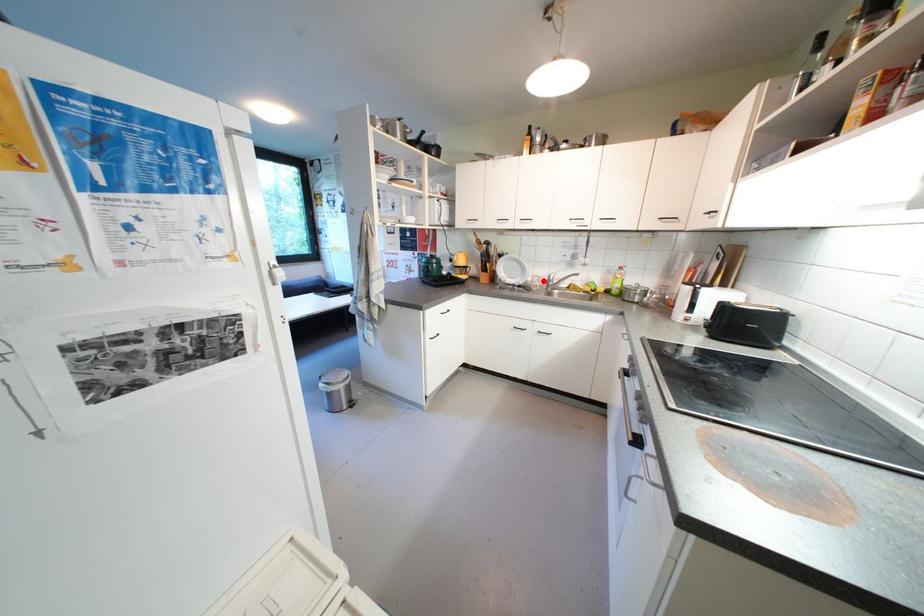
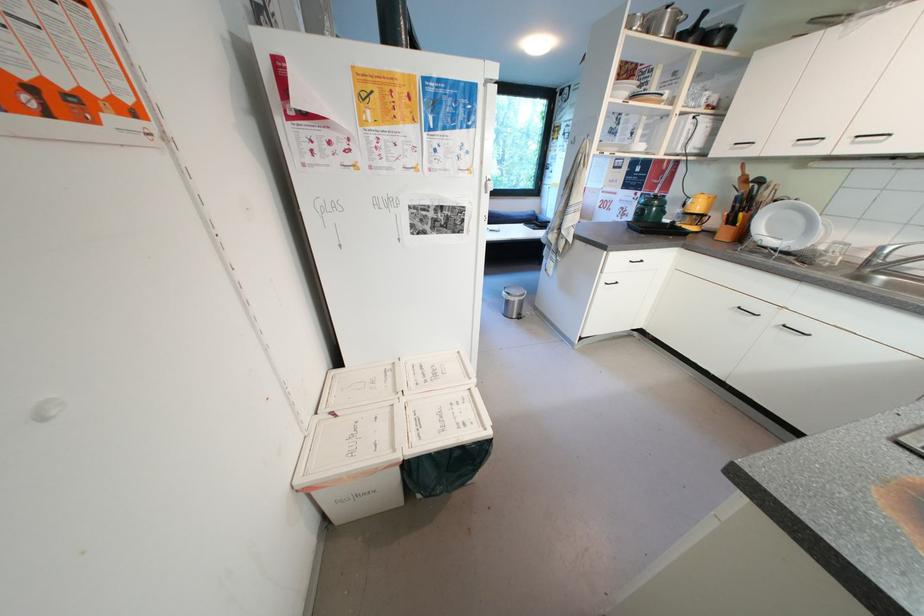
Find the pixel in the second image that matches the highlighted location in the first image.

(845, 249)